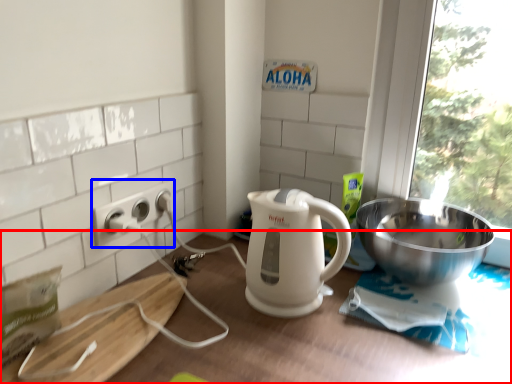
Question: Which of the following is the farthest to the observer, table (highlighted by a red box) or power outlet (highlighted by a blue box)?

Choices:
 (A) table
 (B) power outlet

Answer: (B)